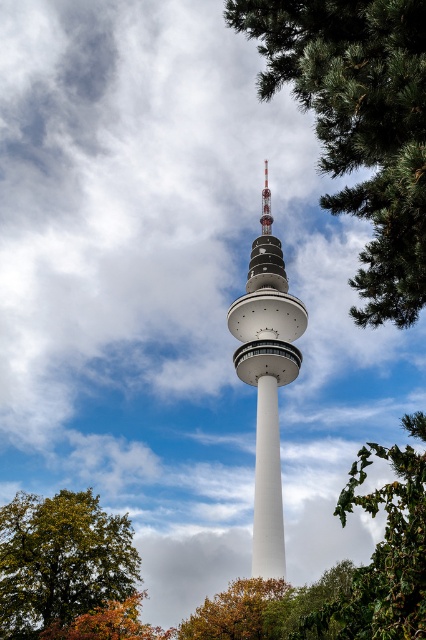
Question: Does white smooth tower at center come in front of autumn leaves at lower center?

Choices:
 (A) yes
 (B) no

Answer: (B)

Question: Does green textured pine tree at upper right have a smaller size compared to orange leafy tree at lower left?

Choices:
 (A) yes
 (B) no

Answer: (A)

Question: Estimate the real-world distances between objects in this image. Which object is closer to the green leafy tree at lower right?

Choices:
 (A) white smooth tower at center
 (B) autumn leaves at lower center
 (C) green leafy tree at lower left
 (D) green textured pine tree at upper right

Answer: (D)

Question: Among these objects, which one is farthest from the camera?

Choices:
 (A) green leafy tree at lower left
 (B) green textured pine tree at upper right

Answer: (A)

Question: Considering the real-world distances, which object is farthest from the green textured pine tree at upper right?

Choices:
 (A) green leafy tree at lower left
 (B) autumn leaves at lower center
 (C) white smooth tower at center

Answer: (C)

Question: Is white smooth tower at center below autumn leaves at lower center?

Choices:
 (A) yes
 (B) no

Answer: (B)